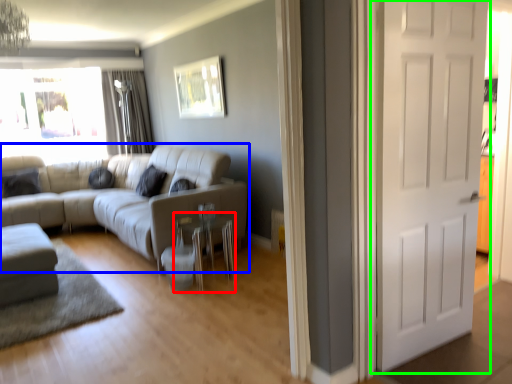
Question: Which object is the farthest from side table (highlighted by a red box)? Choose among these: studio couch (highlighted by a blue box) or door (highlighted by a green box).

Choices:
 (A) studio couch
 (B) door

Answer: (B)